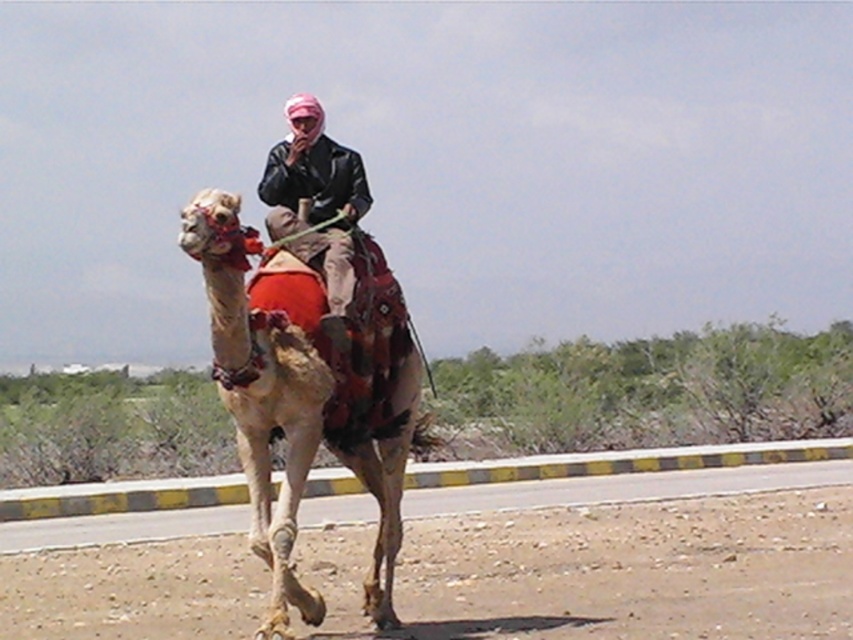
Question: Among these points, which one is farthest from the camera?

Choices:
 (A) (351, 269)
 (B) (260, 376)
 (C) (749, 541)

Answer: (C)

Question: Which of the following is the closest to the observer?

Choices:
 (A) light brown textured camel at center
 (B) brown textured sand at lower center

Answer: (A)

Question: Does brown textured sand at lower center have a lesser width compared to light brown textured camel at center?

Choices:
 (A) no
 (B) yes

Answer: (B)

Question: Estimate the real-world distances between objects in this image. Which object is closer to the light brown textured camel at center?

Choices:
 (A) brown textured sand at lower center
 (B) leather jacket at center

Answer: (B)

Question: Is brown textured sand at lower center to the left of light brown textured camel at center from the viewer's perspective?

Choices:
 (A) yes
 (B) no

Answer: (B)

Question: Is brown textured sand at lower center below light brown textured camel at center?

Choices:
 (A) yes
 (B) no

Answer: (A)